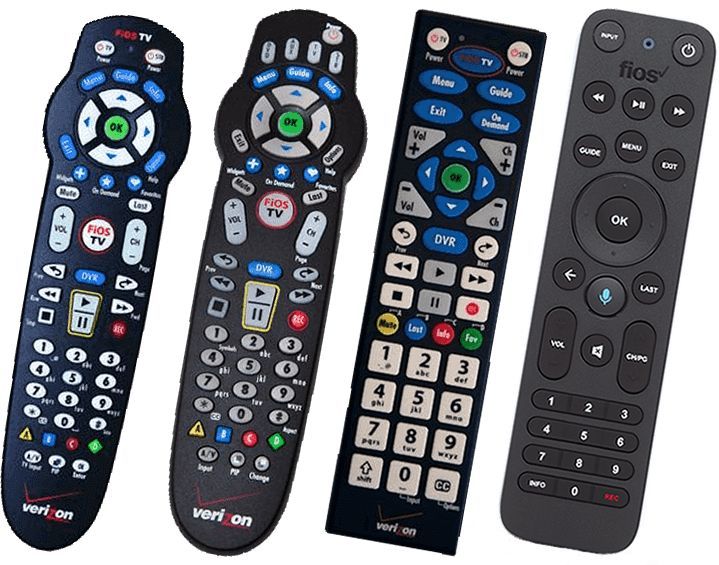
In order to click on remotes in this screenshot , I will do `click(567, 430)`, `click(426, 447)`, `click(262, 418)`, `click(83, 389)`.